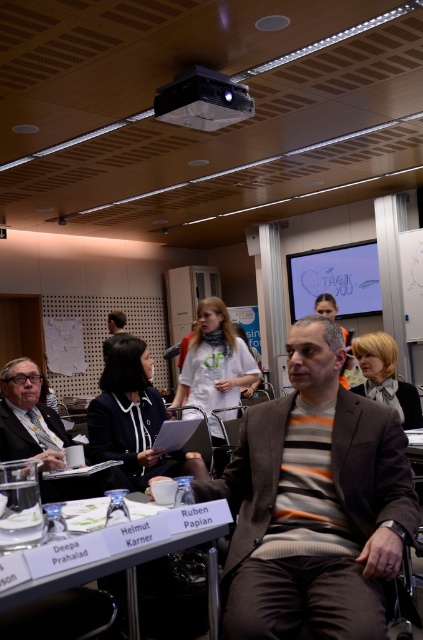
You are organizing a small event and need to place a 1.2 meter wide banner on the table. Based on the image, can the white plastic table at center accommodate the striped wool sweater at center and the banner without overlapping?

The striped wool sweater at center might be wider than the white plastic table at center, so it is uncertain if the banner will fit without overlapping. Check the actual dimensions before placing.

What are the coordinates of the striped wool sweater at center?

The striped wool sweater at center is located at coordinates point (315, 502).